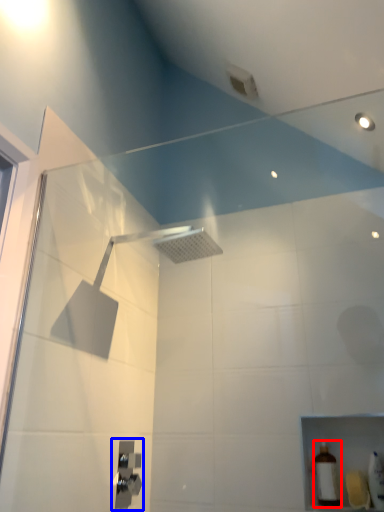
Question: Which point is closer to the camera, toiletry (highlighted by a red box) or shower (highlighted by a blue box)?

Choices:
 (A) toiletry
 (B) shower

Answer: (B)